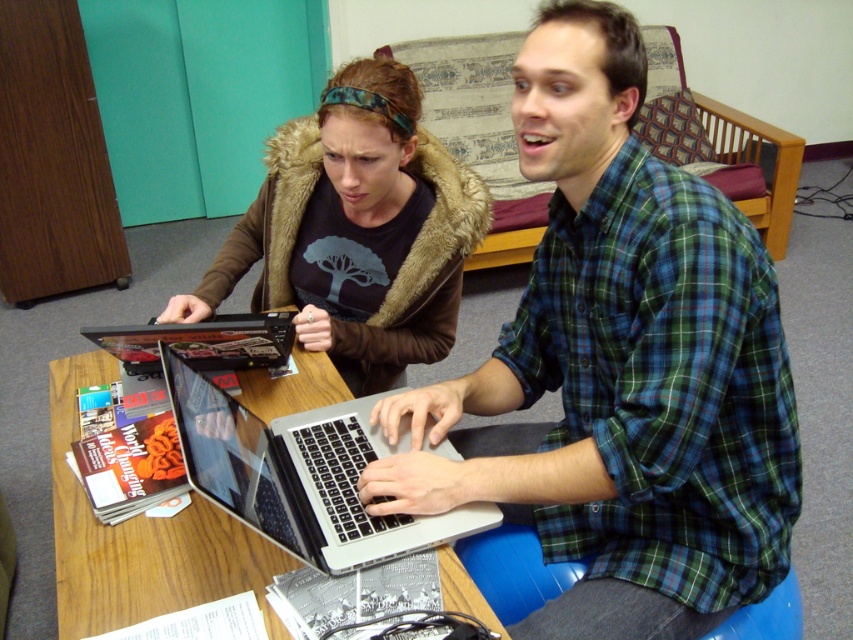
Question: Which point is farther to the camera?

Choices:
 (A) (520, 56)
 (B) (144, 358)

Answer: (B)

Question: Can you confirm if green plaid shirt at center is positioned to the left of brown fur coat at upper left?

Choices:
 (A) yes
 (B) no

Answer: (B)

Question: Can you confirm if green plaid shirt at center is positioned above brown fur coat at upper left?

Choices:
 (A) yes
 (B) no

Answer: (B)

Question: Which of the following is the farthest from the observer?

Choices:
 (A) (260, 593)
 (B) (109, 328)

Answer: (B)

Question: Can you confirm if green plaid shirt at center is smaller than brown fur coat at upper left?

Choices:
 (A) no
 (B) yes

Answer: (A)

Question: Among these points, which one is farthest from the camera?

Choices:
 (A) (355, 177)
 (B) (105, 577)

Answer: (A)